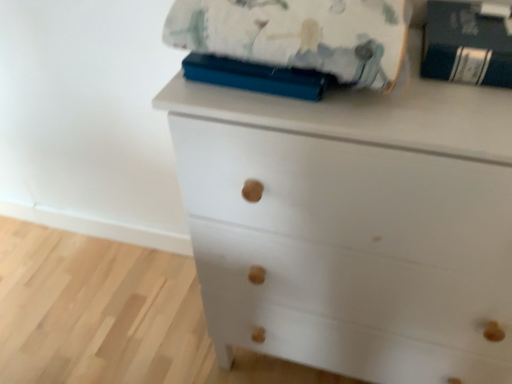
Question: Looking at their shapes, would you say dark blue hardcover book at upper right is wider or thinner than fluffy cotton blanket at upper center?

Choices:
 (A) wide
 (B) thin

Answer: (B)

Question: Considering the positions of dark blue hardcover book at upper right and fluffy cotton blanket at upper center in the image, is dark blue hardcover book at upper right taller or shorter than fluffy cotton blanket at upper center?

Choices:
 (A) tall
 (B) short

Answer: (B)

Question: Based on their relative distances, which object is nearer to the white matte chest of drawers at center?

Choices:
 (A) fluffy cotton blanket at upper center
 (B) dark blue hardcover book at upper right

Answer: (A)

Question: Which object is positioned closest to the dark blue hardcover book at upper right?

Choices:
 (A) white matte chest of drawers at center
 (B) fluffy cotton blanket at upper center

Answer: (B)